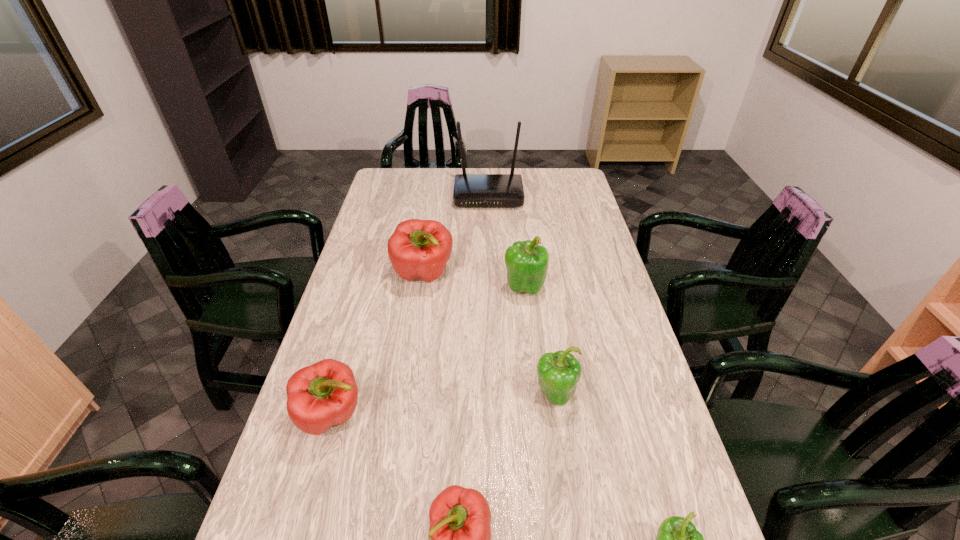
Choose which object is the fifth nearest neighbor to the biggest green bell pepper. Please provide its 2D coordinates. Your answer should be formatted as a tuple, i.e. [(x, y)], where the tuple contains the x and y coordinates of a point satisfying the conditions above.

[(460, 533)]

This screenshot has height=540, width=960. I want to click on object that can be found as the third closest to the biggest pink bell pepper, so click(324, 394).

This screenshot has width=960, height=540. Find the location of `bell pepper object that ranks as the fifth closest to the rightmost green bell pepper`. bell pepper object that ranks as the fifth closest to the rightmost green bell pepper is located at coordinates (418, 249).

Select which bell pepper appears as the fourth closest to the smallest pink bell pepper. Please provide its 2D coordinates. Your answer should be formatted as a tuple, i.e. [(x, y)], where the tuple contains the x and y coordinates of a point satisfying the conditions above.

[(526, 262)]

Point out which green bell pepper is positioned as the second nearest to the farthest pink bell pepper. Please provide its 2D coordinates. Your answer should be formatted as a tuple, i.e. [(x, y)], where the tuple contains the x and y coordinates of a point satisfying the conditions above.

[(558, 373)]

Identify which green bell pepper is located as the nearest to the biggest pink bell pepper. Please provide its 2D coordinates. Your answer should be formatted as a tuple, i.e. [(x, y)], where the tuple contains the x and y coordinates of a point satisfying the conditions above.

[(526, 262)]

This screenshot has width=960, height=540. I want to click on pink bell pepper that is the closest to the farthest object, so click(418, 249).

Identify which pink bell pepper is located as the nearest to the second smallest pink bell pepper. Please provide its 2D coordinates. Your answer should be formatted as a tuple, i.e. [(x, y)], where the tuple contains the x and y coordinates of a point satisfying the conditions above.

[(460, 533)]